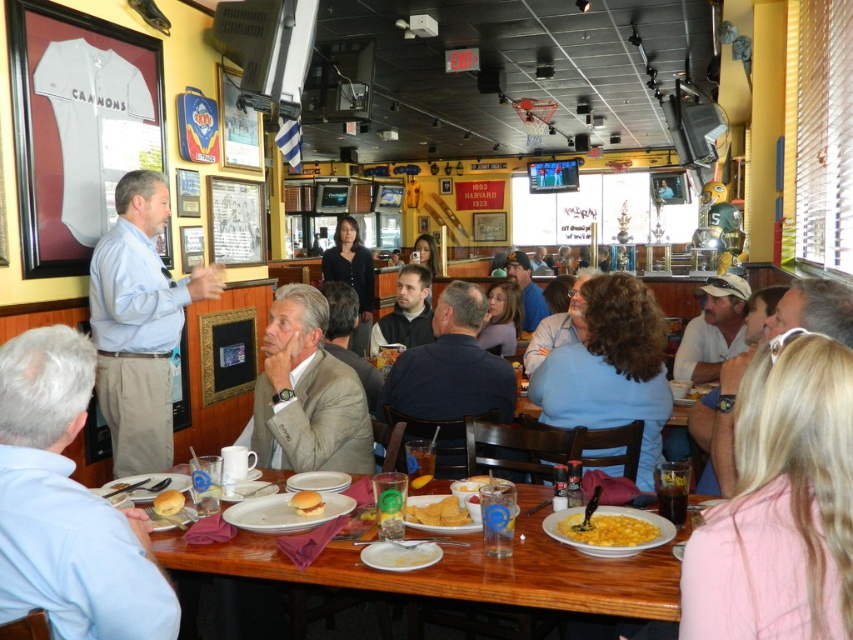
Question: Which point is farther to the camera?

Choices:
 (A) dark blue shirt at center
 (B) light blue shirt at left
 (C) yellow tortilla chips at center

Answer: (B)

Question: Which point appears closest to the camera in this image?

Choices:
 (A) (827, 477)
 (B) (68, 474)
 (C) (544, 412)

Answer: (A)

Question: Does light blue sweater at center appear on the left side of wooden table at lower center?

Choices:
 (A) yes
 (B) no

Answer: (B)

Question: Which point is farther from the camera taking this photo?

Choices:
 (A) (419, 508)
 (B) (635, 358)

Answer: (B)

Question: In this image, where is light blue shirt at left located relative to dark gray sweater at center?

Choices:
 (A) right
 (B) left

Answer: (B)

Question: Does wooden table at lower center have a smaller size compared to dark gray sweater at center?

Choices:
 (A) no
 (B) yes

Answer: (A)